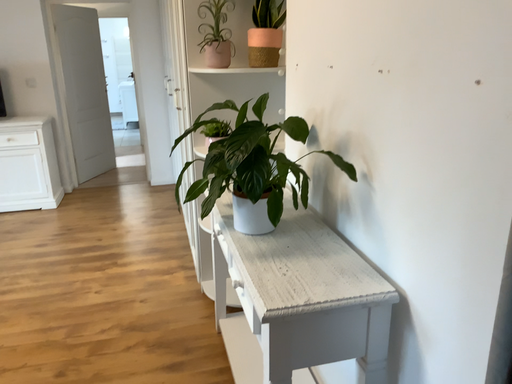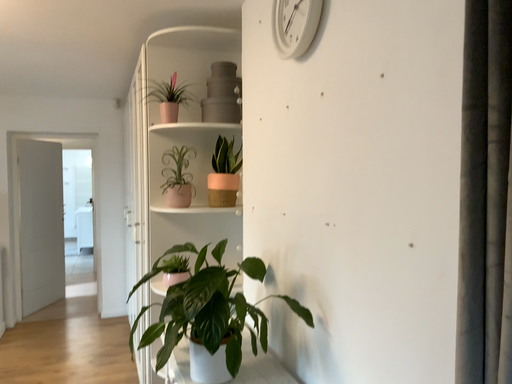
Question: Which way did the camera rotate in the video?

Choices:
 (A) rotated upward
 (B) rotated downward

Answer: (A)